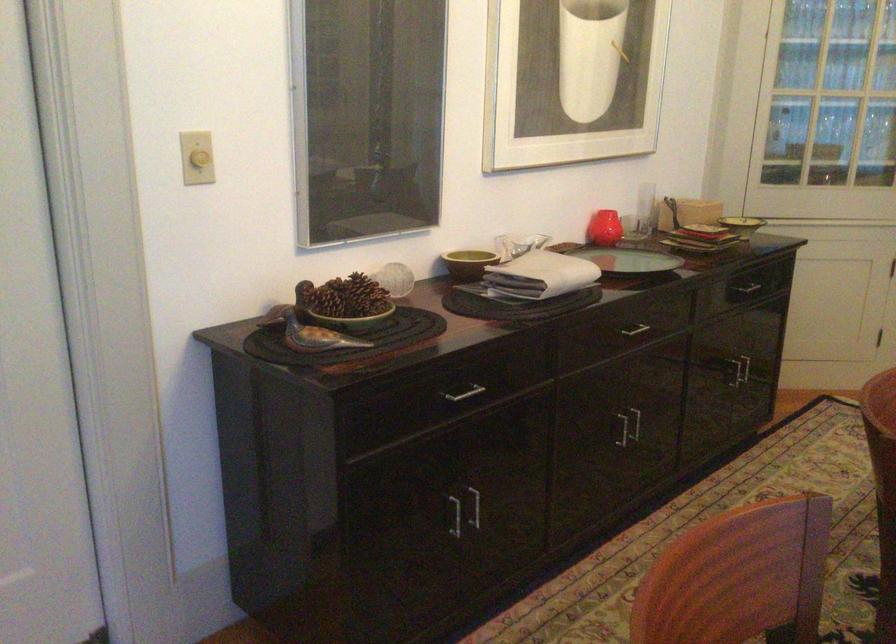
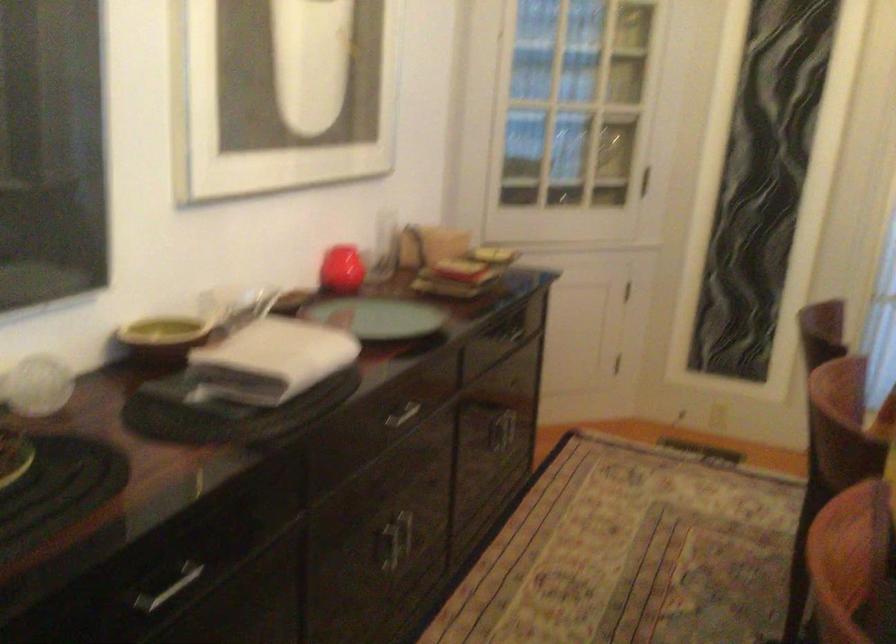
Question: The camera is either moving clockwise (left) or counter-clockwise (right) around the object. The first image is from the beginning of the video and the second image is from the end. Is the camera moving left or right when shooting the video?

Choices:
 (A) Left
 (B) Right

Answer: (A)